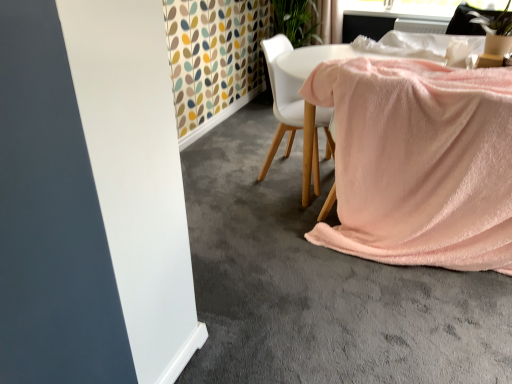
Question: Does white fabric chair at center have a lesser height compared to pink soft fabric at center?

Choices:
 (A) no
 (B) yes

Answer: (A)

Question: Does white fabric chair at center have a smaller size compared to pink soft fabric at center?

Choices:
 (A) yes
 (B) no

Answer: (A)

Question: Are white fabric chair at center and pink soft fabric at center beside each other?

Choices:
 (A) yes
 (B) no

Answer: (B)

Question: Is white fabric chair at center thinner than pink soft fabric at center?

Choices:
 (A) yes
 (B) no

Answer: (A)

Question: Considering the relative sizes of white fabric chair at center and pink soft fabric at center in the image provided, is white fabric chair at center wider than pink soft fabric at center?

Choices:
 (A) yes
 (B) no

Answer: (B)

Question: Based on their positions, is pink soft blanket at lower right located to the left or right of white fabric chair at center?

Choices:
 (A) right
 (B) left

Answer: (A)

Question: From a real-world perspective, is pink soft blanket at lower right physically located above or below white fabric chair at center?

Choices:
 (A) above
 (B) below

Answer: (B)

Question: In the image, is pink soft blanket at lower right positioned in front of or behind white fabric chair at center?

Choices:
 (A) front
 (B) behind

Answer: (A)

Question: In terms of width, does pink soft blanket at lower right look wider or thinner when compared to white fabric chair at center?

Choices:
 (A) thin
 (B) wide

Answer: (B)

Question: In the image, is pink soft fabric at center positioned in front of or behind white fabric chair at center?

Choices:
 (A) behind
 (B) front

Answer: (B)

Question: In terms of width, does pink soft fabric at center look wider or thinner when compared to white fabric chair at center?

Choices:
 (A) thin
 (B) wide

Answer: (B)

Question: Is pink soft fabric at center situated inside white fabric chair at center or outside?

Choices:
 (A) inside
 (B) outside

Answer: (B)

Question: From their relative heights in the image, would you say pink soft fabric at center is taller or shorter than white fabric chair at center?

Choices:
 (A) short
 (B) tall

Answer: (A)

Question: Based on their sizes in the image, would you say white fabric chair at center is bigger or smaller than green leafy plant at upper right?

Choices:
 (A) big
 (B) small

Answer: (A)

Question: In terms of height, does white fabric chair at center look taller or shorter compared to green leafy plant at upper right?

Choices:
 (A) tall
 (B) short

Answer: (A)